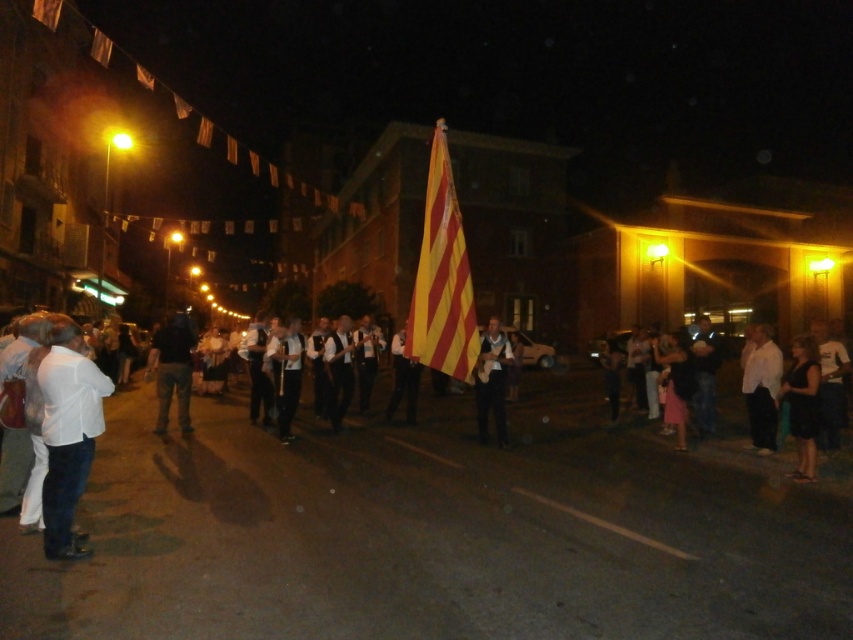
Question: Among these points, which one is farthest from the camera?

Choices:
 (A) (811, 381)
 (B) (404, 340)

Answer: (B)

Question: Does yellow/red striped fabric at center lie behind white shirt at center?

Choices:
 (A) no
 (B) yes

Answer: (A)

Question: Which object is farther from the camera taking this photo?

Choices:
 (A) yellow/red striped fabric at center
 (B) yellow striped fabric at center
 (C) white matte shirt at right

Answer: (C)

Question: Among these points, which one is farthest from the camera?

Choices:
 (A) (67, 362)
 (B) (190, 426)
 (C) (776, 369)
 (D) (795, 403)

Answer: (B)

Question: Does white cotton shirt at left appear under white shirt at center?

Choices:
 (A) no
 (B) yes

Answer: (A)

Question: Does dark blue jeans at center appear on the left side of light blue jeans at center?

Choices:
 (A) no
 (B) yes

Answer: (B)